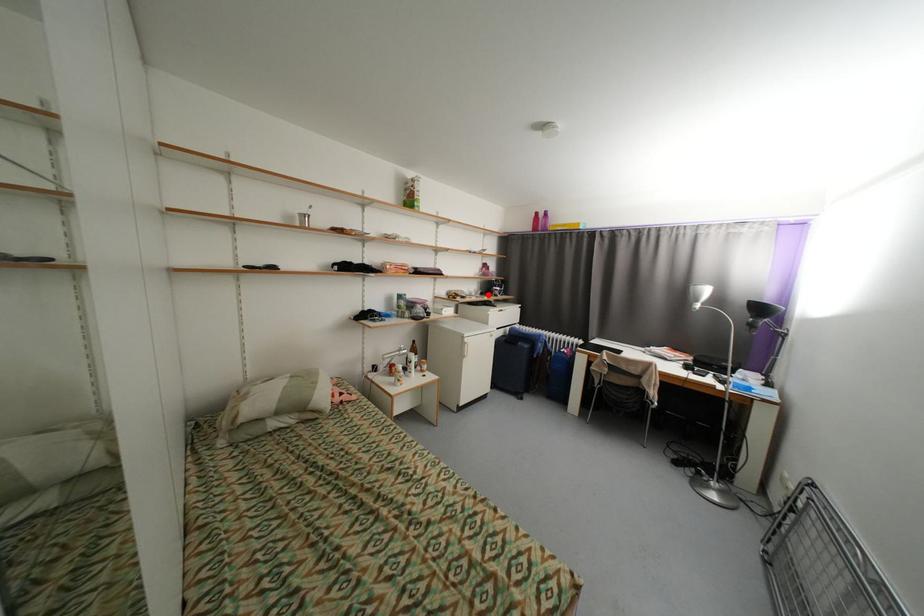
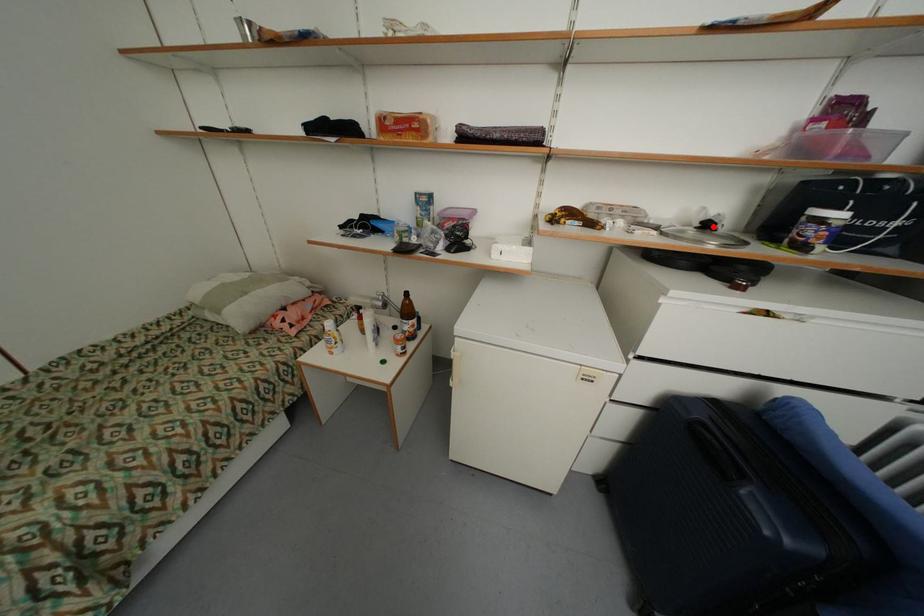
I am providing you with two images of the same scene from different viewpoints. A red point is marked on the first image and another point is marked on the second image. Do the highlighted points in image1 and image2 indicate the same real-world spot?

Yes